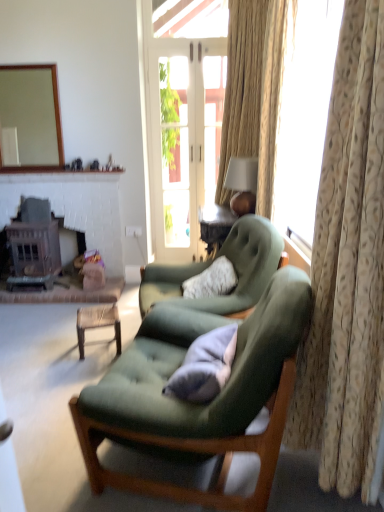
Where is `vacant space situated above clear glass door at center (from a real-world perspective)`? vacant space situated above clear glass door at center (from a real-world perspective) is located at coordinates (172, 38).